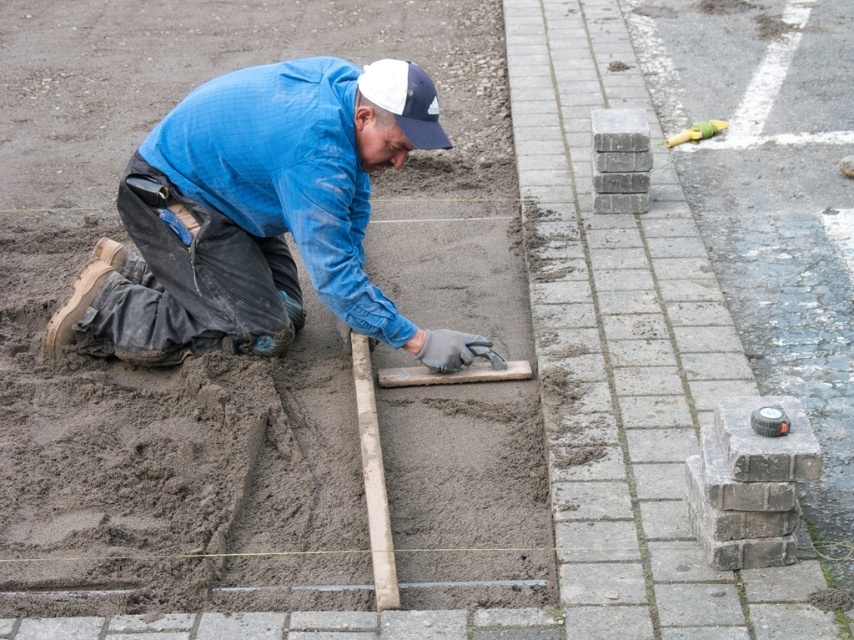
You are a construction supervisor checking the safety gear of the worker in the image. The blue denim jacket at center and the white fabric baseball cap at upper center are visible. Which item is taller?

The blue denim jacket at center is much taller than the white fabric baseball cap at upper center.